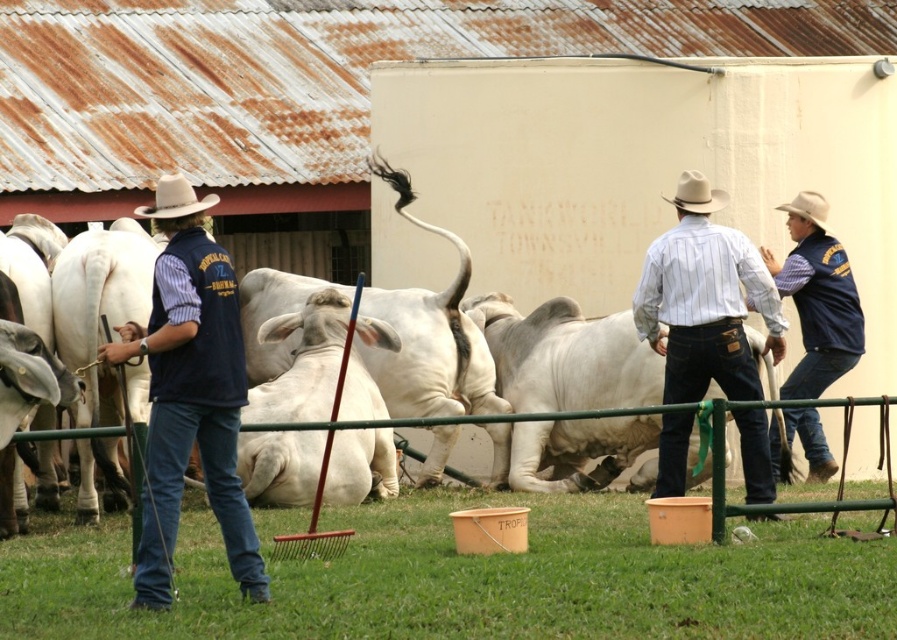
Question: Does matte blue vest at left lie behind white smooth bull at center?

Choices:
 (A) yes
 (B) no

Answer: (B)

Question: Among these points, which one is nearest to the camera?

Choices:
 (A) (716, 196)
 (B) (701, 301)

Answer: (B)

Question: Does white smooth bull at center come in front of blue denim jeans at right?

Choices:
 (A) no
 (B) yes

Answer: (B)

Question: Is white smooth bull at center closer to camera compared to striped cotton shirt at center?

Choices:
 (A) no
 (B) yes

Answer: (B)

Question: Estimate the real-world distances between objects in this image. Which object is closer to the matte blue vest at left?

Choices:
 (A) white felt cowboy hat at center
 (B) blue denim jeans at right
 (C) white matte cowboy hat at upper right
 (D) white smooth bull at center

Answer: (D)

Question: Estimate the real-world distances between objects in this image. Which object is farther from the striped cotton shirt at center?

Choices:
 (A) white felt cowboy hat at center
 (B) blue denim jeans at right
 (C) white smooth bull at center

Answer: (B)